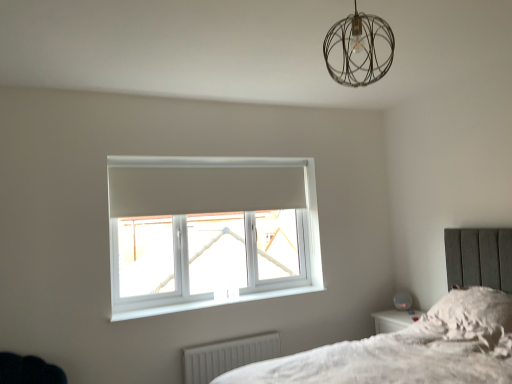
Question: Considering their positions, is fluffy white pillow at lower right located in front of or behind white plastic window at center?

Choices:
 (A) front
 (B) behind

Answer: (A)

Question: Is fluffy white pillow at lower right spatially inside white plastic window at center, or outside of it?

Choices:
 (A) inside
 (B) outside

Answer: (B)

Question: Which of these objects is positioned closest to the white plastic window sill at lower center?

Choices:
 (A) white ribbed radiator at lower center
 (B) fluffy white pillow at lower right
 (C) white plastic window at center
 (D) metallic wire sphere at upper center

Answer: (C)

Question: Estimate the real-world distances between objects in this image. Which object is closer to the white plastic window at center?

Choices:
 (A) fluffy white pillow at lower right
 (B) white plastic window sill at lower center
 (C) white ribbed radiator at lower center
 (D) metallic wire sphere at upper center

Answer: (B)